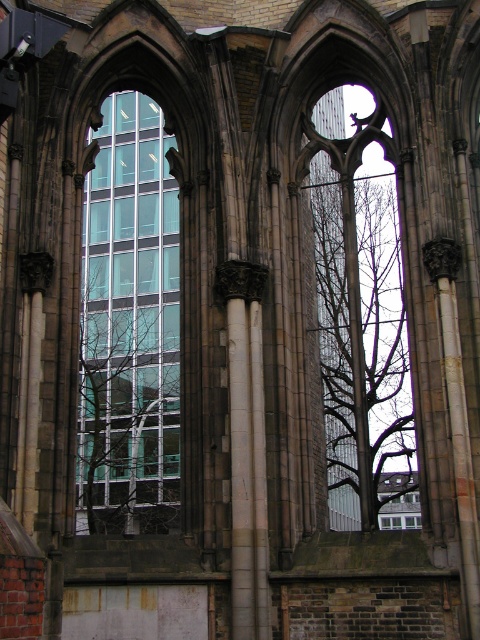
You are an architect analyzing the spatial relationship between two points in the image. Given that point A is at coordinates point (147, 200) and point B is at coordinates point (235, 410), which point is located further away from the viewer?

Point point (147, 200) is behind point point (235, 410), so it is further away from the viewer.

You are a window cleaner who needs to clean both the transparent glass building at center and the white marble pillar at center. Which one will require you to climb higher?

The transparent glass building at center is taller than the white marble pillar at center, so you will need to climb higher to clean the transparent glass building at center.

You are an architect analyzing the layout of the scene. You notice the transparent glass building at center and the bare branches at center. Which object is located to the left of the other?

The transparent glass building at center is positioned on the left side of bare branches at center, so it is to the left of the bare branches at center.